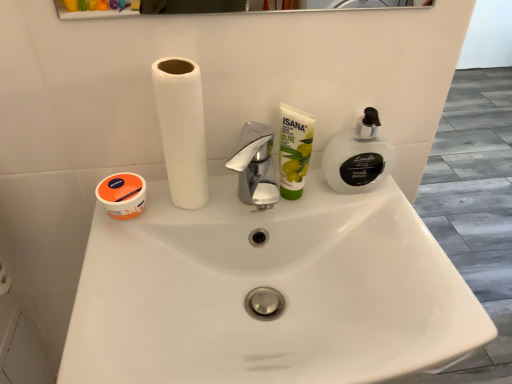
Question: From a real-world perspective, relative to white matte paper towel at center, is green matte olive oil cream at center vertically above or below?

Choices:
 (A) above
 (B) below

Answer: (B)

Question: Is point (289, 127) positioned closer to the camera than point (173, 132)?

Choices:
 (A) farther
 (B) closer

Answer: (A)

Question: Which object is positioned farthest from the orange matte cream at left?

Choices:
 (A) green matte olive oil cream at center
 (B) white translucent pump at right
 (C) white glossy sink at center
 (D) white matte paper towel at center

Answer: (B)

Question: Based on their relative distances, which object is nearer to the white glossy sink at center?

Choices:
 (A) white matte paper towel at center
 (B) white translucent pump at right
 (C) green matte olive oil cream at center
 (D) orange matte cream at left

Answer: (C)